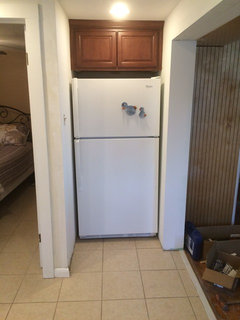
This screenshot has width=240, height=320. In order to click on grout between tile in this screenshot , I will do `click(57, 302)`, `click(101, 312)`, `click(102, 280)`, `click(102, 263)`.